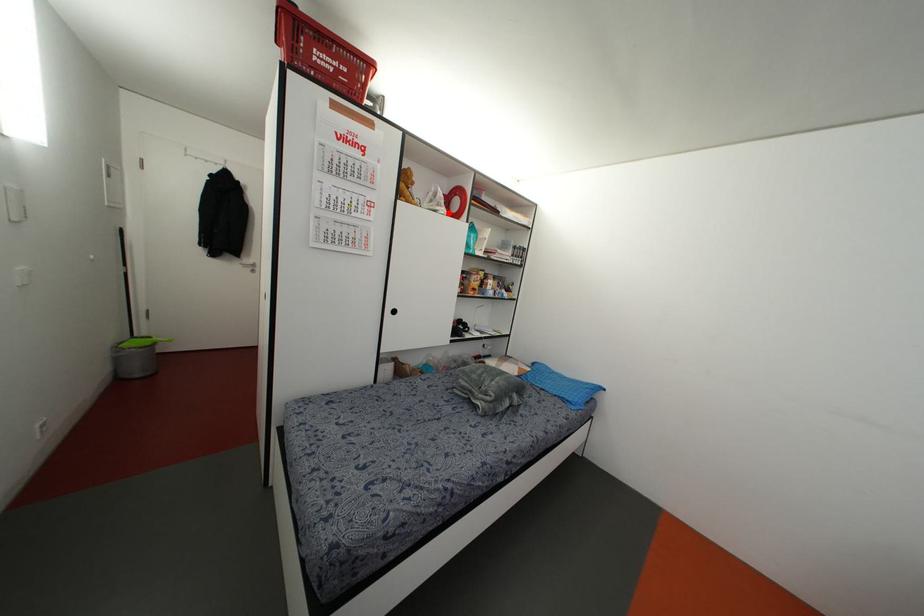
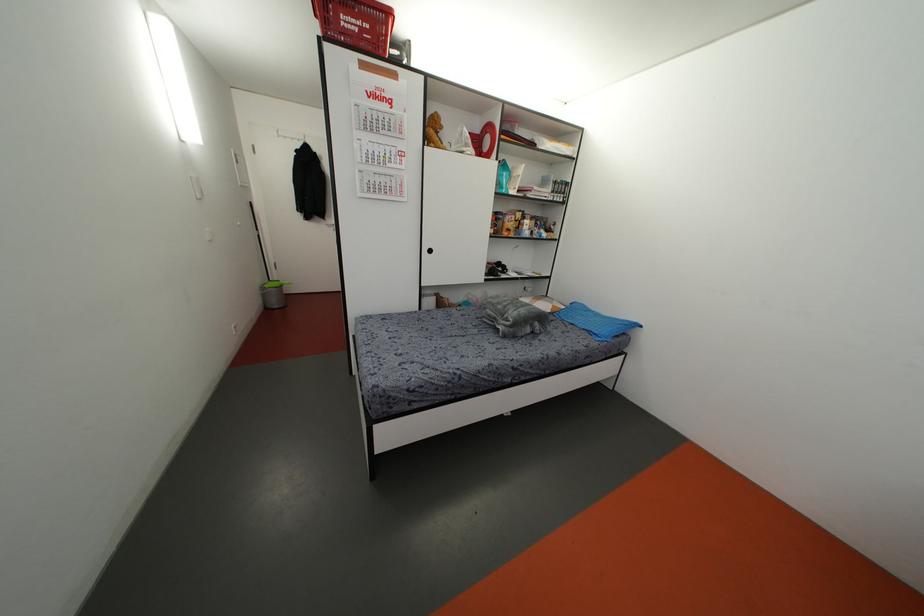
Locate, in the second image, the point that corresponds to the highlighted location in the first image.

(479, 153)